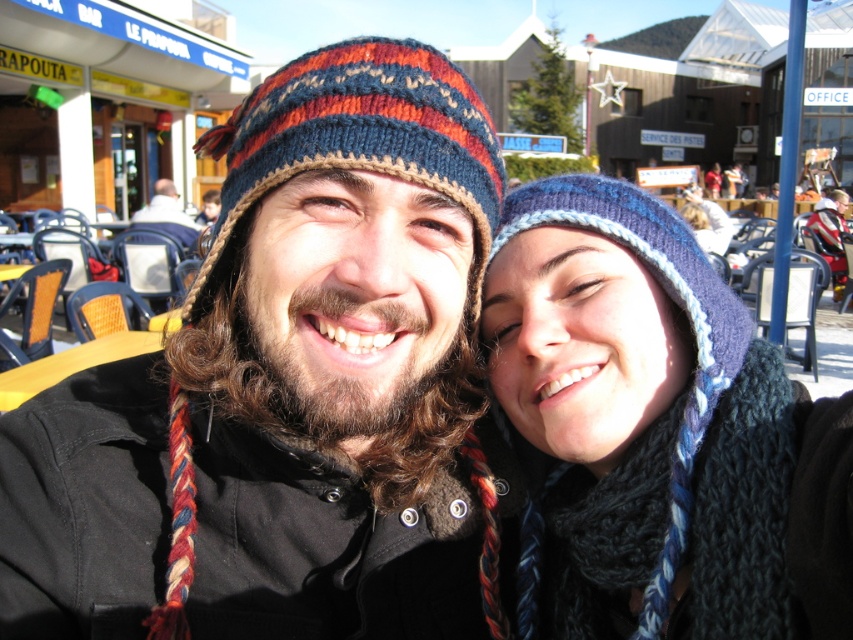
You are designing a display for winter accessories and need to place the blue knitted hat at center and the knitted woolen hat at center on a shelf. If the shelf has limited width, which hat should you choose to fit better in a narrow space?

The blue knitted hat at center is thinner than the knitted woolen hat at center, so it would fit better in a narrow space.

You are a photographer at a ski resort and need to position two people for a photo. You have to place the blue knitted hat at center and the knitted woolen hat at center such that their hats are visible in the frame. Based on their current positions, which hat should you move to ensure both are centered and aligned properly?

The blue knitted hat at center is to the right of the knitted woolen hat at center. To center both hats, move the blue knitted hat at center slightly to the left so it aligns with the knitted woolen hat at center.